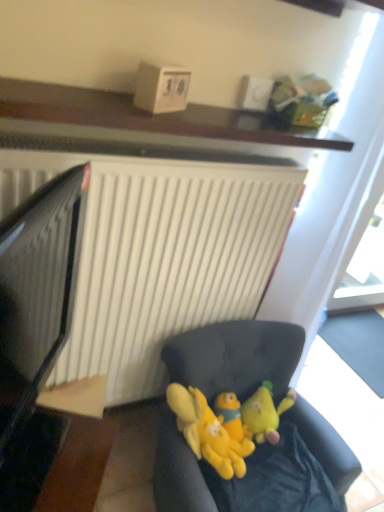
Question: Is black glossy computer monitor at left in front of soft fabric couch at lower center?

Choices:
 (A) no
 (B) yes

Answer: (B)

Question: Can soft fabric couch at lower center be found inside black glossy computer monitor at left?

Choices:
 (A) no
 (B) yes

Answer: (A)

Question: Can you see black glossy computer monitor at left touching soft fabric couch at lower center?

Choices:
 (A) yes
 (B) no

Answer: (B)

Question: Considering the relative sizes of black glossy computer monitor at left and soft fabric couch at lower center in the image provided, is black glossy computer monitor at left thinner than soft fabric couch at lower center?

Choices:
 (A) yes
 (B) no

Answer: (A)

Question: Is black glossy computer monitor at left smaller than soft fabric couch at lower center?

Choices:
 (A) yes
 (B) no

Answer: (A)

Question: Is wooden shelf at upper center inside the boundaries of yellow plush toy at center, the second toy viewed from the right, or outside?

Choices:
 (A) inside
 (B) outside

Answer: (B)

Question: In terms of height, does wooden shelf at upper center look taller or shorter compared to yellow plush toy at center, the second toy viewed from the right?

Choices:
 (A) tall
 (B) short

Answer: (B)

Question: From a real-world perspective, is wooden shelf at upper center above or below yellow plush toy at center, marked as the second toy in a left-to-right arrangement?

Choices:
 (A) above
 (B) below

Answer: (A)

Question: Would you say wooden shelf at upper center is to the left or to the right of yellow plush toy at center, the second toy viewed from the right, in the picture?

Choices:
 (A) right
 (B) left

Answer: (B)

Question: Is yellow plush toys at center, positioned as the 3th toy in right-to-left order, wider or thinner than black glossy computer monitor at left?

Choices:
 (A) thin
 (B) wide

Answer: (B)

Question: From the image's perspective, is yellow plush toys at center, positioned as the 3th toy in right-to-left order, located above or below black glossy computer monitor at left?

Choices:
 (A) below
 (B) above

Answer: (A)

Question: Considering the positions of point (190, 426) and point (26, 318), is point (190, 426) closer or farther from the camera than point (26, 318)?

Choices:
 (A) closer
 (B) farther

Answer: (A)

Question: Is yellow plush toys at center, positioned as the 3th toy in right-to-left order, in front of or behind black glossy computer monitor at left in the image?

Choices:
 (A) behind
 (B) front

Answer: (A)

Question: Considering the positions of point (4, 88) and point (233, 471), is point (4, 88) closer or farther from the camera than point (233, 471)?

Choices:
 (A) closer
 (B) farther

Answer: (A)

Question: Considering the positions of wooden shelf at upper center and yellow plush toys at center, placed as the 1th toy when sorted from left to right, in the image, is wooden shelf at upper center wider or thinner than yellow plush toys at center, placed as the 1th toy when sorted from left to right,?

Choices:
 (A) wide
 (B) thin

Answer: (A)